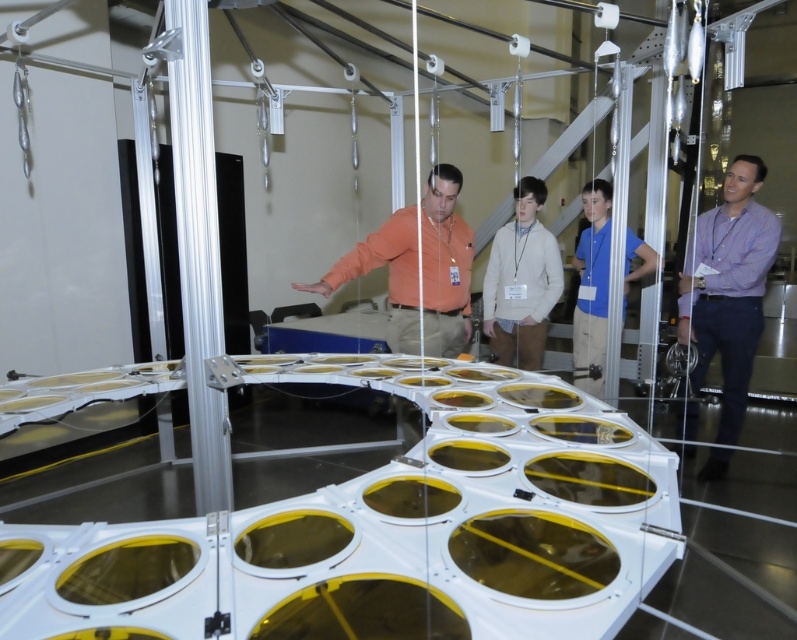
You are standing at the origin point of the coordinate system in the laboratory. You need to locate the orange fabric shirt at center. What are its coordinates?

The orange fabric shirt at center is located at coordinates point [444,266].

You are a researcher in the lab and need to determine which person is shorter between the orange fabric shirt at center and the blue shirt at center. Based on the scene, which one is shorter?

The orange fabric shirt at center is not as tall as blue shirt at center, so the orange fabric shirt at center is shorter.

You are standing at the entrance of the laboratory and see two points marked in the scene. The first point is at coordinates point (719, 321) and the second point is at point (529, 314). Which point is closer to you?

Point (719, 321) is in front of point (529, 314), so it is closer to you.